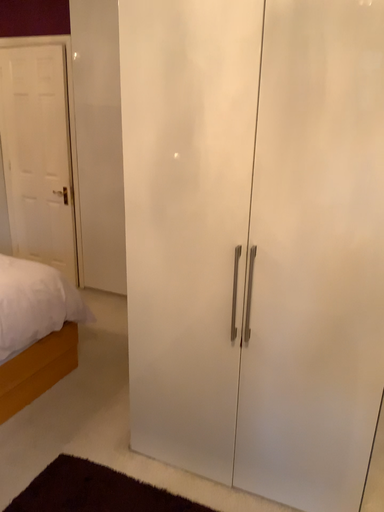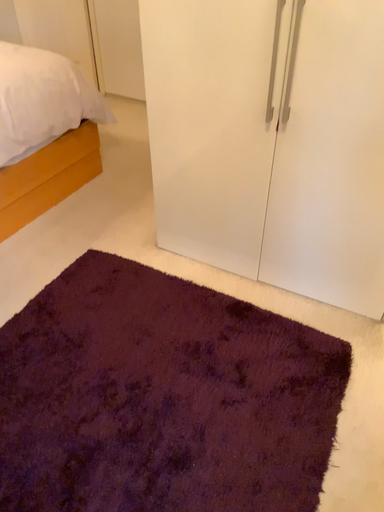
Question: How did the camera likely rotate when shooting the video?

Choices:
 (A) rotated downward
 (B) rotated upward

Answer: (A)